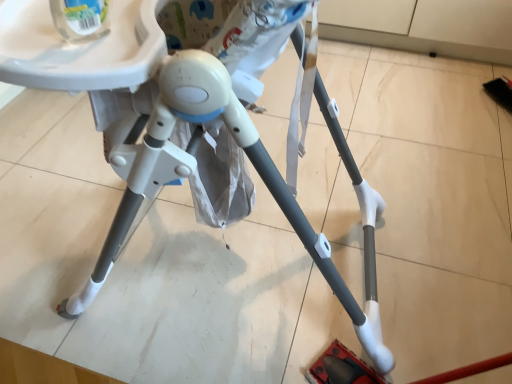
At what (x,y) coordinates should I click in order to perform the action: click on vacant region below white plastic tripod at center (from a real-world perspective). Please return your answer as a coordinate pair (x, y). Looking at the image, I should click on (219, 270).